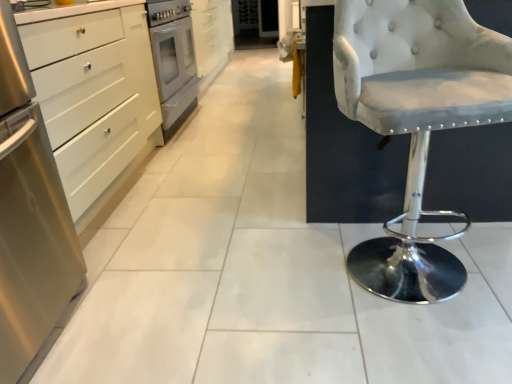
Question: Is white glossy cabinet at upper left, the 2th cabinetry viewed from the front, facing away from stainless steel cabinet at left, which appears as the first cabinetry when ordered from the bottom?

Choices:
 (A) yes
 (B) no

Answer: (B)

Question: Considering the relative sizes of white glossy cabinet at upper left, the 1th cabinetry from the right, and stainless steel cabinet at left, which appears as the first cabinetry when ordered from the bottom, in the image provided, is white glossy cabinet at upper left, the 1th cabinetry from the right, thinner than stainless steel cabinet at left, which appears as the first cabinetry when ordered from the bottom,?

Choices:
 (A) yes
 (B) no

Answer: (A)

Question: Is white glossy cabinet at upper left, the second cabinetry positioned from the left, smaller than stainless steel cabinet at left, the 2th cabinetry in the right-to-left sequence?

Choices:
 (A) no
 (B) yes

Answer: (B)

Question: Is white glossy cabinet at upper left, which is the first cabinetry in back-to-front order, taller than stainless steel cabinet at left, which is the first cabinetry from left to right?

Choices:
 (A) no
 (B) yes

Answer: (A)

Question: Considering the relative positions of white glossy cabinet at upper left, which is the first cabinetry in back-to-front order, and stainless steel cabinet at left, the 2th cabinetry in the right-to-left sequence, in the image provided, is white glossy cabinet at upper left, which is the first cabinetry in back-to-front order, behind stainless steel cabinet at left, the 2th cabinetry in the right-to-left sequence,?

Choices:
 (A) yes
 (B) no

Answer: (A)

Question: Can you confirm if white glossy cabinet at upper left, which is the first cabinetry in back-to-front order, is wider than stainless steel cabinet at left, which is the second cabinetry in top-to-bottom order?

Choices:
 (A) no
 (B) yes

Answer: (A)

Question: Can you confirm if stainless steel oven at center-left is bigger than white tufted fabric stool at right?

Choices:
 (A) no
 (B) yes

Answer: (B)

Question: Can you confirm if stainless steel oven at center-left is shorter than white tufted fabric stool at right?

Choices:
 (A) yes
 (B) no

Answer: (B)

Question: Is the position of stainless steel oven at center-left more distant than that of white tufted fabric stool at right?

Choices:
 (A) yes
 (B) no

Answer: (A)

Question: From a real-world perspective, is stainless steel oven at center-left on top of white tufted fabric stool at right?

Choices:
 (A) no
 (B) yes

Answer: (A)

Question: From the image's perspective, is stainless steel oven at center-left above white tufted fabric stool at right?

Choices:
 (A) yes
 (B) no

Answer: (A)

Question: Is stainless steel oven at center-left smaller than white tufted fabric stool at right?

Choices:
 (A) yes
 (B) no

Answer: (B)

Question: Is stainless steel oven at center-left positioned with its back to white glossy cabinet at upper left, placed as the first cabinetry when sorted from top to bottom?

Choices:
 (A) no
 (B) yes

Answer: (A)